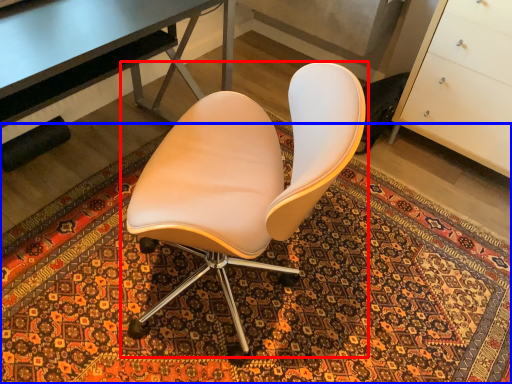
Question: Which object appears closest to the camera in this image, chair (highlighted by a red box) or mat (highlighted by a blue box)?

Choices:
 (A) chair
 (B) mat

Answer: (A)